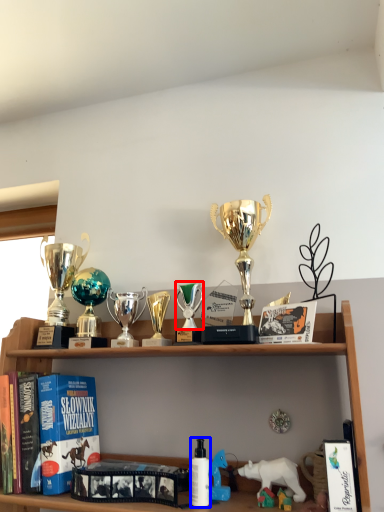
Question: Which of the following is the farthest to the observer, toy (highlighted by a red box) or toiletry (highlighted by a blue box)?

Choices:
 (A) toy
 (B) toiletry

Answer: (A)